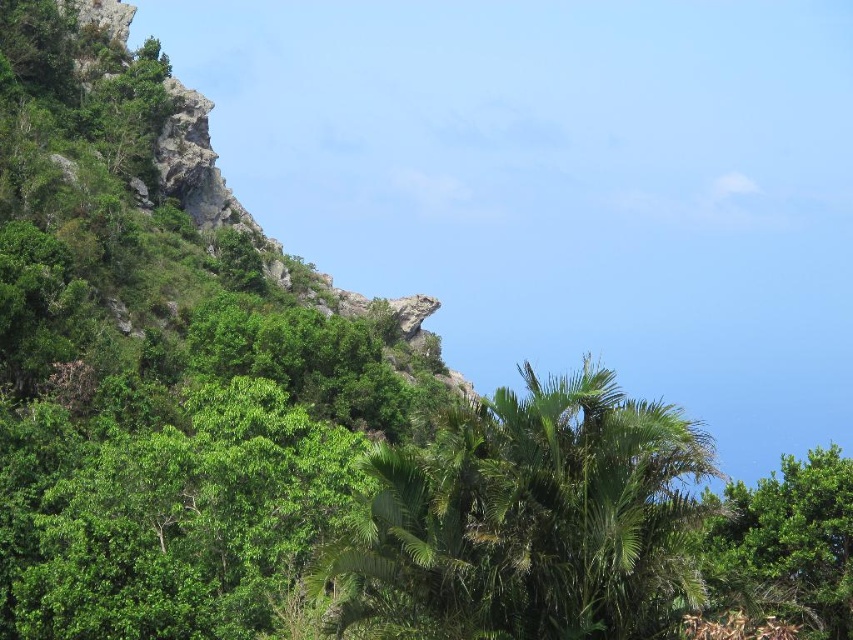
You are a hiker who wants to take a photo of the rugged stone mountain at upper left and the green leafy tree at lower right. Which object should you focus on first to ensure both are in the frame?

You should focus on the rugged stone mountain at upper left first because it is closer to you than the green leafy tree at lower right, so adjusting the focus from near to far will help capture both in the frame.